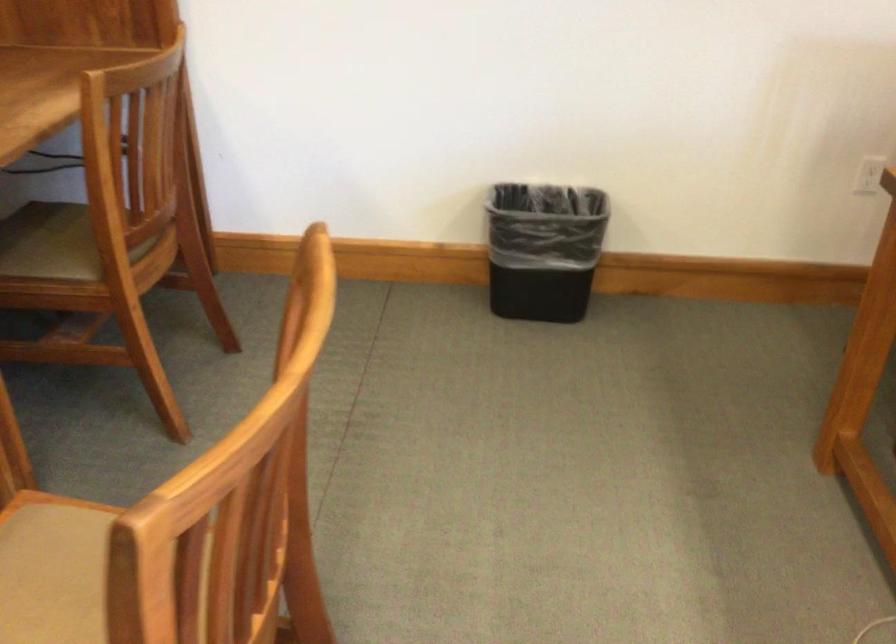
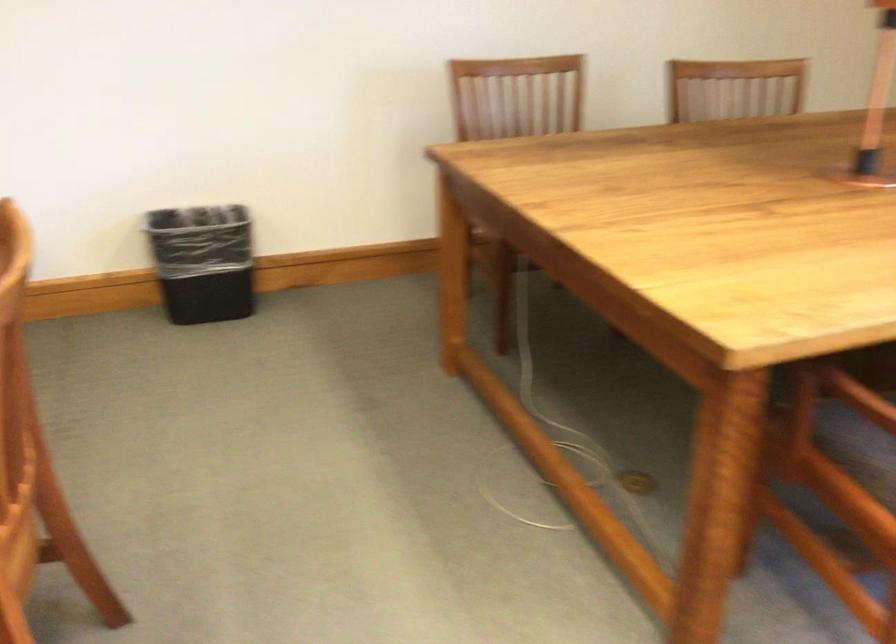
Locate, in the second image, the point that corresponds to point 540,252 in the first image.

(202, 261)